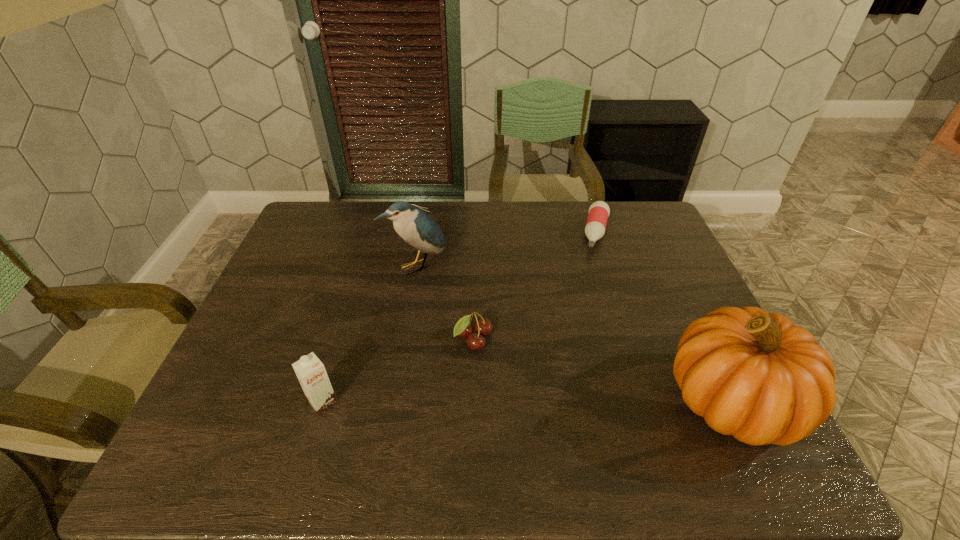
Find the location of a particular element. The width and height of the screenshot is (960, 540). chocolate milk is located at coordinates (311, 373).

The image size is (960, 540). What are the coordinates of `the third tallest object` in the screenshot? It's located at (311, 373).

The image size is (960, 540). I want to click on pumpkin, so click(x=755, y=375).

The height and width of the screenshot is (540, 960). I want to click on bottle, so click(x=599, y=211).

Locate an element on the screen. This screenshot has height=540, width=960. the second object from left to right is located at coordinates (417, 228).

Locate an element on the screen. cherry is located at coordinates (482, 326).

Where is `the third object from right to left`? This screenshot has width=960, height=540. the third object from right to left is located at coordinates (482, 326).

This screenshot has height=540, width=960. Identify the location of blank area located on the left of the chocolate milk. (228, 402).

Where is `free space located on the back of the pumpkin`? The height and width of the screenshot is (540, 960). free space located on the back of the pumpkin is located at coordinates (690, 314).

The image size is (960, 540). In order to click on vacant space situated 0.060m with the cap open on the bottle in this screenshot , I will do `click(596, 266)`.